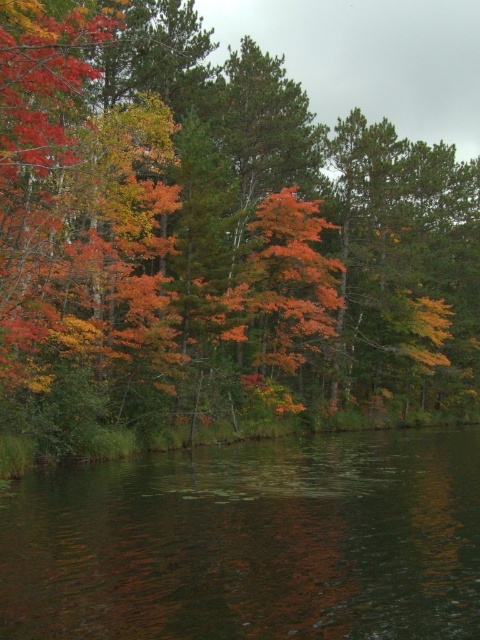
Question: Is orange leafy tree at center above dark reflective water at lower center?

Choices:
 (A) no
 (B) yes

Answer: (B)

Question: Which point is closer to the camera taking this photo?

Choices:
 (A) (304, 312)
 (B) (348, 614)

Answer: (B)

Question: Which point is closer to the camera taking this photo?

Choices:
 (A) (286, 541)
 (B) (323, 310)

Answer: (A)

Question: Is orange leafy tree at center to the left of dark reflective water at lower center from the viewer's perspective?

Choices:
 (A) yes
 (B) no

Answer: (B)

Question: In this image, where is orange leafy tree at center located relative to dark reflective water at lower center?

Choices:
 (A) left
 (B) right

Answer: (B)

Question: Which point appears closest to the camera in this image?

Choices:
 (A) (463, 344)
 (B) (478, 563)

Answer: (B)